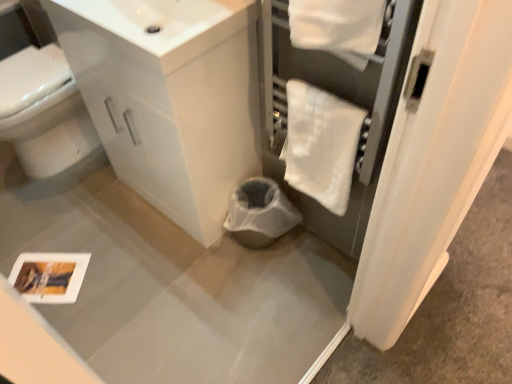
What is the approximate height of white fluffy bath towel at upper right?

white fluffy bath towel at upper right is 31.28 centimeters tall.

What do you see at coordinates (44, 112) in the screenshot?
I see `white glossy bidet at left` at bounding box center [44, 112].

This screenshot has width=512, height=384. What do you see at coordinates (164, 23) in the screenshot? I see `white glossy sink at upper center` at bounding box center [164, 23].

Locate an element on the screen. The width and height of the screenshot is (512, 384). white fluffy bath towel at upper right is located at coordinates (321, 144).

In the scene shown: From the image's perspective, is white glossy sink at upper center above or below white glossy bidet at left?

From the image's perspective, white glossy sink at upper center appears above white glossy bidet at left.

Considering the relative positions of white glossy sink at upper center and white glossy bidet at left in the image provided, is white glossy sink at upper center in front of white glossy bidet at left?

Yes.

From a real-world perspective, is white glossy sink at upper center under white glossy bidet at left?

Incorrect, from a real-world perspective, white glossy sink at upper center is higher than white glossy bidet at left.

Does point (213, 45) come in front of point (42, 85)?

Yes, point (213, 45) is closer to viewer.

Which of these two, white fluffy bath towel at upper right or white glossy sink at upper center, is bigger?

white glossy sink at upper center is bigger.

From the image's perspective, is white fluffy bath towel at upper right over white glossy sink at upper center?

No, from the image's perspective, white fluffy bath towel at upper right is not on top of white glossy sink at upper center.

Locate an element on the screen. The height and width of the screenshot is (384, 512). bath towel lying on the right of white glossy sink at upper center is located at coordinates (321, 144).

Does white fluffy bath towel at upper right have a greater width compared to white glossy sink at upper center?

Incorrect, the width of white fluffy bath towel at upper right does not surpass that of white glossy sink at upper center.

Can we say white fluffy bath towel at upper right lies outside white glossy bidet at left?

white fluffy bath towel at upper right lies outside white glossy bidet at left's area.

From a real-world perspective, relative to white glossy bidet at left, is white fluffy bath towel at upper right vertically above or below?

In terms of real-world spatial position, white fluffy bath towel at upper right is above white glossy bidet at left.

Does white fluffy bath towel at upper right have a lesser width compared to white glossy bidet at left?

Indeed, white fluffy bath towel at upper right has a lesser width compared to white glossy bidet at left.

Is white glossy bidet at left not close to white glossy sink at upper center?

No, white glossy bidet at left is in close proximity to white glossy sink at upper center.

Is white glossy bidet at left inside or outside of white glossy sink at upper center?

white glossy bidet at left lies outside white glossy sink at upper center.

From the image's perspective, between white glossy bidet at left and white glossy sink at upper center, which one is located above?

From the image's view, white glossy sink at upper center is above.

Which is closer, (47, 131) or (214, 11)?

Point (47, 131) is positioned farther from the camera compared to point (214, 11).

Which is behind, point (152, 47) or point (345, 136)?

The point (345, 136) is farther from the camera.

Is white glossy sink at upper center to the left or to the right of white fluffy bath towel at upper right in the image?

In the image, white glossy sink at upper center appears on the left side of white fluffy bath towel at upper right.

From the image's perspective, is white glossy sink at upper center under white fluffy bath towel at upper right?

Incorrect, from the image's perspective, white glossy sink at upper center is higher than white fluffy bath towel at upper right.

Between white glossy sink at upper center and white fluffy bath towel at upper right, which one has larger width?

white glossy sink at upper center is wider.

Looking at this image, from a real-world perspective, between white glossy bidet at left and white fluffy bath towel at upper right, who is vertically lower?

white glossy bidet at left is physically lower.

Can you confirm if white glossy bidet at left is bigger than white fluffy bath towel at upper right?

Yes.

Is white glossy bidet at left turned away from white fluffy bath towel at upper right?

No, white glossy bidet at left's orientation is not away from white fluffy bath towel at upper right.

In the scene shown: Is white glossy bidet at left to the left or to the right of white fluffy bath towel at upper right in the image?

Based on their positions, white glossy bidet at left is located to the left of white fluffy bath towel at upper right.

Where is `bidet on the left of white glossy sink at upper center`? Image resolution: width=512 pixels, height=384 pixels. bidet on the left of white glossy sink at upper center is located at coordinates (44, 112).

Where is `sink located in front of the white fluffy bath towel at upper right`? sink located in front of the white fluffy bath towel at upper right is located at coordinates (164, 23).

When comparing their distances from white glossy bidet at left, does white fluffy bath towel at upper right or white glossy sink at upper center seem further?

Based on the image, white fluffy bath towel at upper right appears to be further to white glossy bidet at left.

Estimate the real-world distances between objects in this image. Which object is closer to white glossy bidet at left, white glossy sink at upper center or white fluffy bath towel at upper right?

white glossy sink at upper center is closer to white glossy bidet at left.

Which object lies nearer to the anchor point white fluffy bath towel at upper right, white glossy sink at upper center or white glossy bidet at left?

white glossy sink at upper center lies closer to white fluffy bath towel at upper right than the other object.

Considering their positions, is white fluffy bath towel at upper right positioned closer to white glossy sink at upper center than white glossy bidet at left?

white fluffy bath towel at upper right.

Considering their positions, is white glossy bidet at left positioned further to white glossy sink at upper center than white fluffy bath towel at upper right?

white glossy bidet at left is further to white glossy sink at upper center.

Looking at this image, estimate the real-world distances between objects in this image. Which object is closer to white fluffy bath towel at upper right, white glossy bidet at left or white glossy sink at upper center?

Among the two, white glossy sink at upper center is located nearer to white fluffy bath towel at upper right.

Locate an element on the screen. The width and height of the screenshot is (512, 384). sink between white glossy bidet at left and white fluffy bath towel at upper right from left to right is located at coordinates (164, 23).